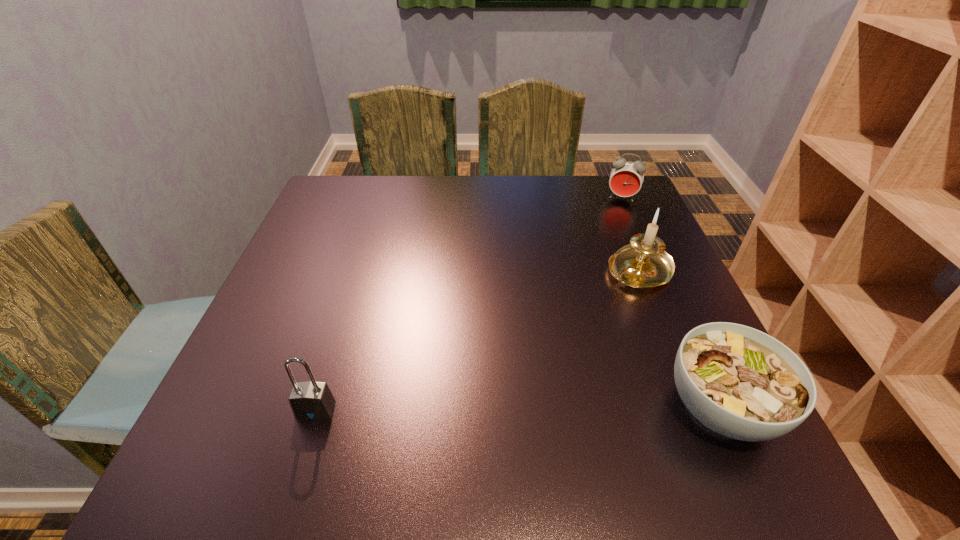
This screenshot has width=960, height=540. I want to click on free spot on the desktop that is between the leftmost object and the shortest object and is positioned on the handle side of the candle holder, so click(484, 409).

Where is `vacant space on the desktop that is between the padlock and the shortest object and is positioned on the face of the farthest object`? The width and height of the screenshot is (960, 540). vacant space on the desktop that is between the padlock and the shortest object and is positioned on the face of the farthest object is located at coordinates (575, 408).